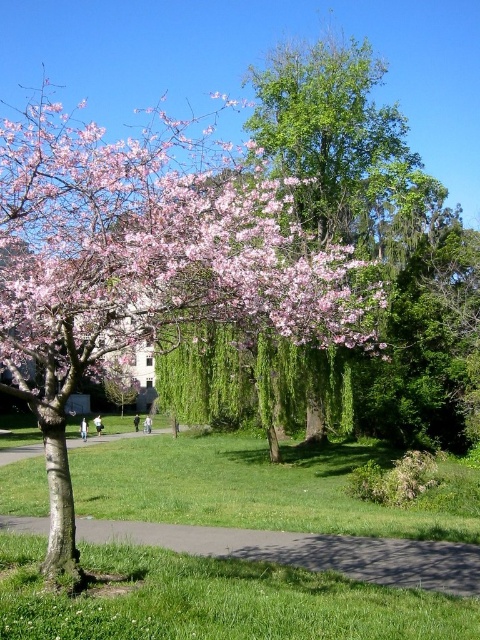
You are a photographer trying to capture the pink bloom at upper left and the green grass at lower left in the same frame. Which object should you focus on first if you want to ensure both are in focus?

The pink bloom at upper left is bigger than green grass at lower left, so focusing on the pink bloom at upper left first would help ensure both are in focus as it is the larger subject.

Consider the image. You are standing at the point labeled point [55,218] and want to walk to the point labeled point [406,552]. Which direction should you move to get closer to your destination?

You should move towards the direction away from the camera since point [55,218] is closer to the camera than point [406,552].